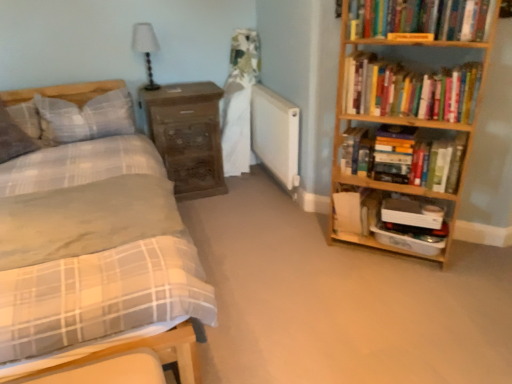
Locate an element on the screen. free space in front of wooden bookcase at right is located at coordinates (411, 296).